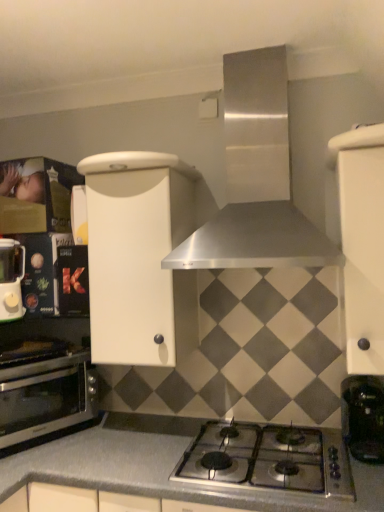
Image resolution: width=384 pixels, height=512 pixels. In order to click on blank space above gray matte countertop at lower center (from a real-world perspective) in this screenshot , I will do `click(190, 459)`.